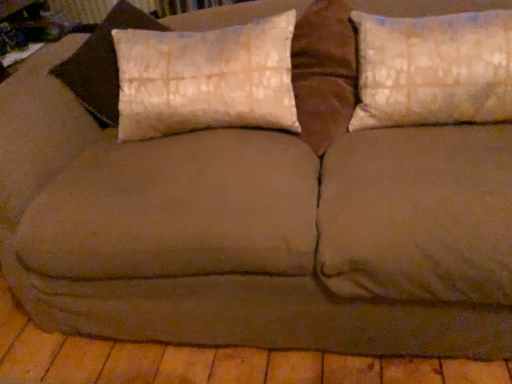
Question: From the image's perspective, would you say white textured pillow at center, marked as the first pillow in a left-to-right arrangement, is positioned over textured beige pillow at upper right, which is the first pillow in right-to-left order?

Choices:
 (A) yes
 (B) no

Answer: (B)

Question: Can you confirm if white textured pillow at center, which ranks as the second pillow in right-to-left order, is bigger than textured beige pillow at upper right, which is the first pillow in right-to-left order?

Choices:
 (A) no
 (B) yes

Answer: (B)

Question: From the image's perspective, is white textured pillow at center, marked as the first pillow in a left-to-right arrangement, under textured beige pillow at upper right, which is the first pillow in right-to-left order?

Choices:
 (A) yes
 (B) no

Answer: (A)

Question: Would you say white textured pillow at center, which ranks as the second pillow in right-to-left order, is outside textured beige pillow at upper right, arranged as the second pillow when viewed from the left?

Choices:
 (A) yes
 (B) no

Answer: (A)

Question: Is white textured pillow at center, which ranks as the second pillow in right-to-left order, thinner than textured beige pillow at upper right, arranged as the second pillow when viewed from the left?

Choices:
 (A) yes
 (B) no

Answer: (B)

Question: From a real-world perspective, is white textured pillow at center, which ranks as the second pillow in right-to-left order, below textured beige pillow at upper right, which is the first pillow in right-to-left order?

Choices:
 (A) yes
 (B) no

Answer: (B)

Question: From a real-world perspective, is textured beige pillow at upper right, arranged as the second pillow when viewed from the left, positioned under white textured pillow at center, marked as the first pillow in a left-to-right arrangement, based on gravity?

Choices:
 (A) yes
 (B) no

Answer: (A)

Question: Does textured beige pillow at upper right, arranged as the second pillow when viewed from the left, have a smaller size compared to white textured pillow at center, which ranks as the second pillow in right-to-left order?

Choices:
 (A) yes
 (B) no

Answer: (A)

Question: Does textured beige pillow at upper right, which is the first pillow in right-to-left order, touch white textured pillow at center, which ranks as the second pillow in right-to-left order?

Choices:
 (A) no
 (B) yes

Answer: (A)

Question: From a real-world perspective, does textured beige pillow at upper right, which is the first pillow in right-to-left order, stand above white textured pillow at center, which ranks as the second pillow in right-to-left order?

Choices:
 (A) no
 (B) yes

Answer: (A)

Question: Considering the relative sizes of textured beige pillow at upper right, arranged as the second pillow when viewed from the left, and white textured pillow at center, which ranks as the second pillow in right-to-left order, in the image provided, is textured beige pillow at upper right, arranged as the second pillow when viewed from the left, wider than white textured pillow at center, which ranks as the second pillow in right-to-left order,?

Choices:
 (A) yes
 (B) no

Answer: (B)

Question: Is textured beige pillow at upper right, arranged as the second pillow when viewed from the left, further to the viewer compared to white textured pillow at center, which ranks as the second pillow in right-to-left order?

Choices:
 (A) yes
 (B) no

Answer: (B)

Question: Is white textured pillow at center, marked as the first pillow in a left-to-right arrangement, wider or thinner than textured beige pillow at upper right, which is the first pillow in right-to-left order?

Choices:
 (A) wide
 (B) thin

Answer: (A)